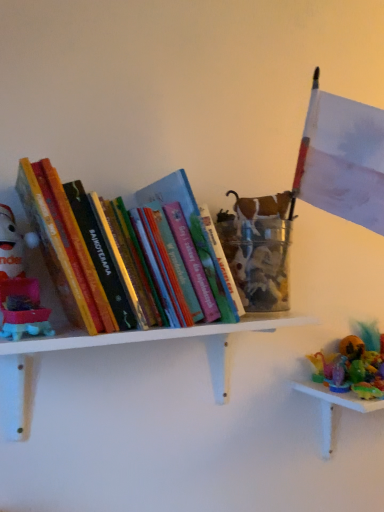
Question: From the image's perspective, relative to plush red santa at left, is hardcover books at left above or below?

Choices:
 (A) below
 (B) above

Answer: (B)

Question: From a real-world perspective, is hardcover books at left above or below plush red santa at left?

Choices:
 (A) above
 (B) below

Answer: (A)

Question: Estimate the real-world distances between objects in this image. Which object is closer to the plush red santa at left?

Choices:
 (A) translucent plastic toys at lower right
 (B) white matte shelf at upper left
 (C) hardcover books at left

Answer: (C)

Question: Which is nearer to the hardcover books at left?

Choices:
 (A) plush red santa at left
 (B) white matte shelf at upper left
 (C) translucent plastic toys at lower right

Answer: (A)